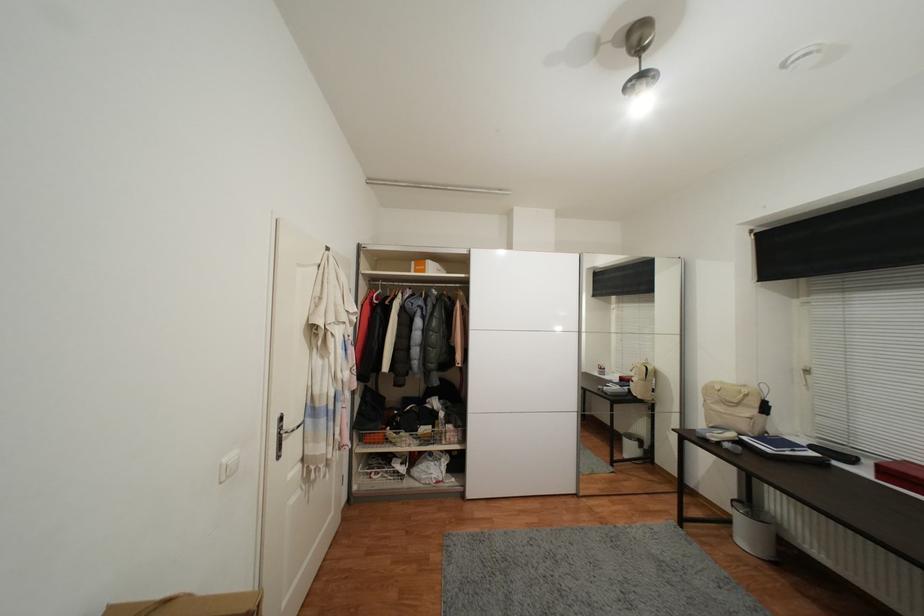
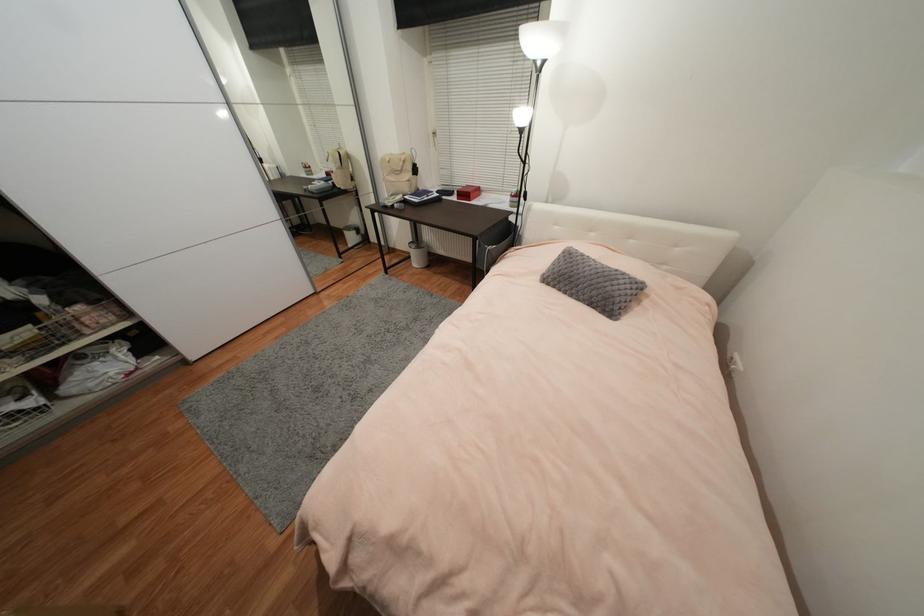
Find the pixel in the second image that matches (x=869, y=474) in the first image.

(458, 199)